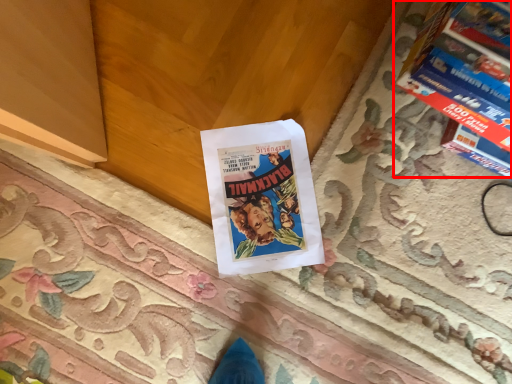
Question: Where is magazine (annotated by the red box) located in relation to book in the image?

Choices:
 (A) right
 (B) left

Answer: (A)